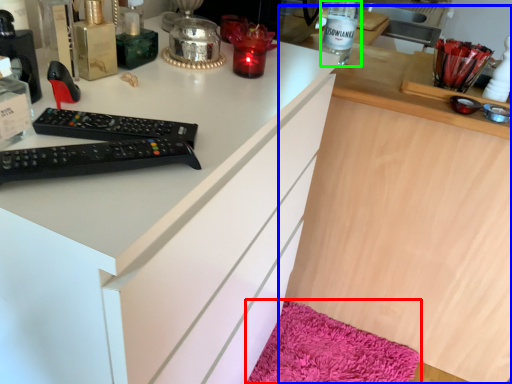
Question: Which is nearer to the bath mat (highlighted by a red box)? computer (highlighted by a blue box) or bottle (highlighted by a green box).

Choices:
 (A) computer
 (B) bottle

Answer: (A)